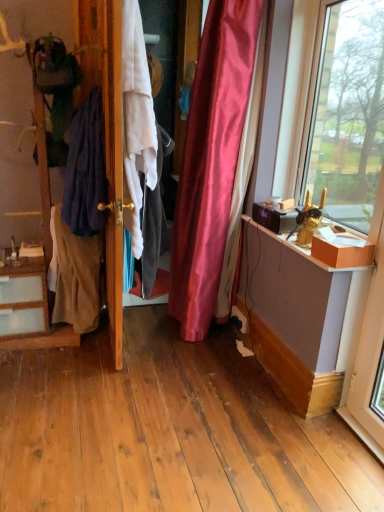
Question: Considering the positions of dark blue fabric at left, the 1th clothing viewed from the left, and dark blue fabric at left, the second clothing in the right-to-left sequence, in the image, is dark blue fabric at left, the 1th clothing viewed from the left, bigger or smaller than dark blue fabric at left, the second clothing in the right-to-left sequence,?

Choices:
 (A) small
 (B) big

Answer: (A)

Question: Is dark blue fabric at left, the 1th clothing viewed from the left, wider or thinner than dark blue fabric at left, the second clothing in the right-to-left sequence?

Choices:
 (A) thin
 (B) wide

Answer: (B)

Question: Which object is the farthest from the dark blue fabric at left, the second clothing in the right-to-left sequence?

Choices:
 (A) white cotton shirt at center, marked as the first clothing in a right-to-left arrangement
 (B) wooden door at center
 (C) dark blue fabric at left, the 1th clothing viewed from the left
 (D) wooden dresser at left

Answer: (A)

Question: Which object is the closest to the dark blue fabric at left, the 3th clothing positioned from the right?

Choices:
 (A) dark blue fabric at left, positioned as the second clothing in left-to-right order
 (B) white cotton shirt at center, marked as the first clothing in a right-to-left arrangement
 (C) wooden door at center
 (D) wooden dresser at left

Answer: (A)